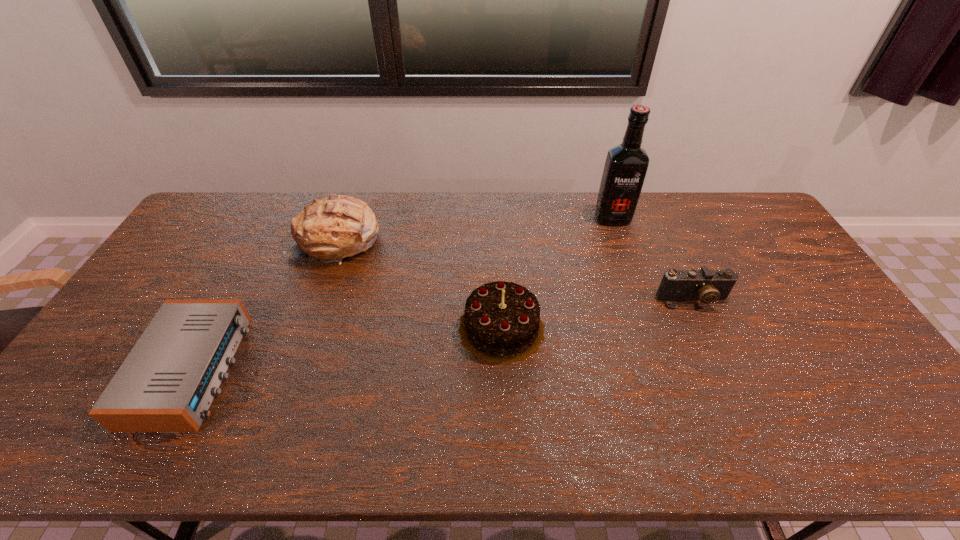
You are a GUI agent. You are given a task and a screenshot of the screen. Output one action in this format:
    pyautogui.click(x=<x>, y=<y>)
    Task: Click on the object that stands as the closest to the bread
    This screenshot has width=960, height=540.
    Given the screenshot: What is the action you would take?
    pyautogui.click(x=167, y=383)

This screenshot has width=960, height=540. What are the coordinates of `free location that satisfies the following two spatial constraints: 1. on the front-facing side of the tallest object; 2. on the front panel of the shortest object` in the screenshot? It's located at (665, 370).

Locate an element on the screen. vacant point that satisfies the following two spatial constraints: 1. on the front-facing side of the fourth tallest object; 2. on the front panel of the radio receiver is located at coordinates (726, 370).